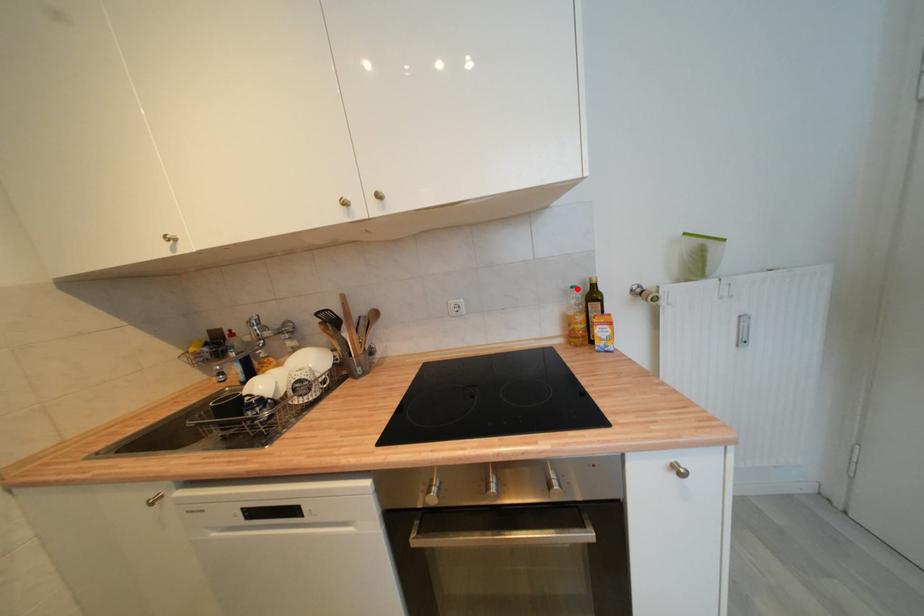
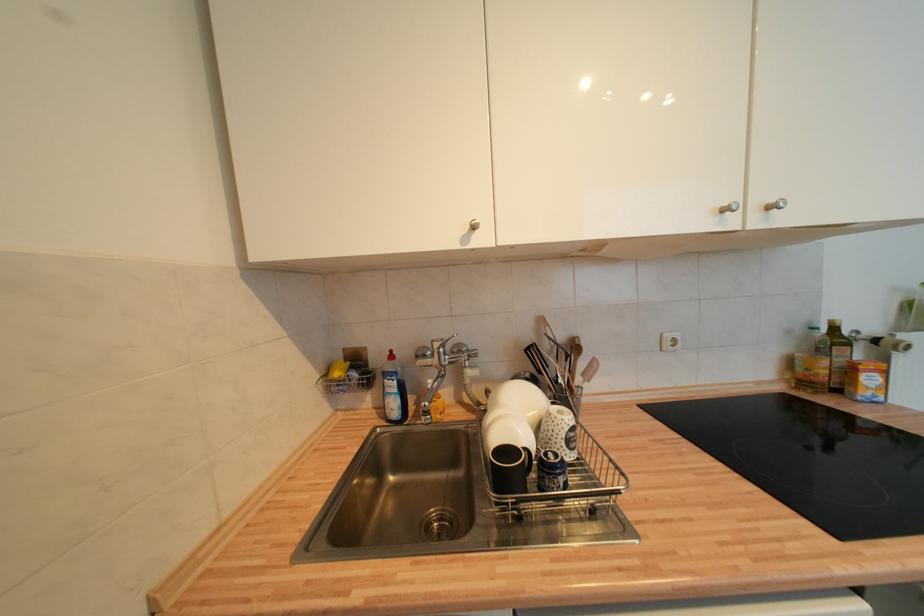
Locate, in the second image, the point that corresponds to the highlighted location in the first image.

(819, 331)